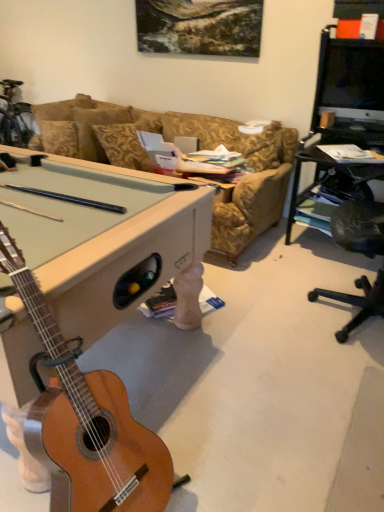
The height and width of the screenshot is (512, 384). What do you see at coordinates (85, 421) in the screenshot? I see `natural wood guitar at lower left` at bounding box center [85, 421].

Where is `natural wood guitar at lower left`? This screenshot has width=384, height=512. natural wood guitar at lower left is located at coordinates (85, 421).

You are a GUI agent. You are given a task and a screenshot of the screen. Output one action in this format:
    pyautogui.click(x=<x>, y=<y>)
    Task: Click on the natural wood guitar at lower left
    The height and width of the screenshot is (512, 384).
    Given the screenshot: What is the action you would take?
    pyautogui.click(x=85, y=421)